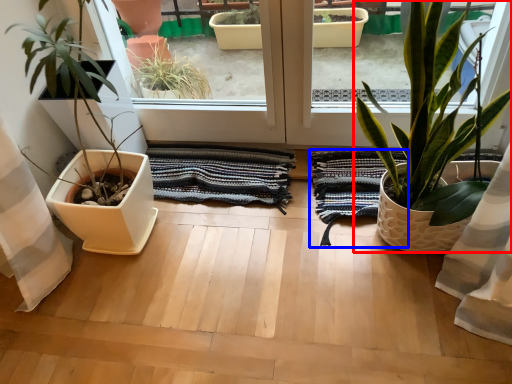
Question: Among these objects, which one is nearest to the camera, houseplant (highlighted by a red box) or bath towel (highlighted by a blue box)?

Choices:
 (A) houseplant
 (B) bath towel

Answer: (A)